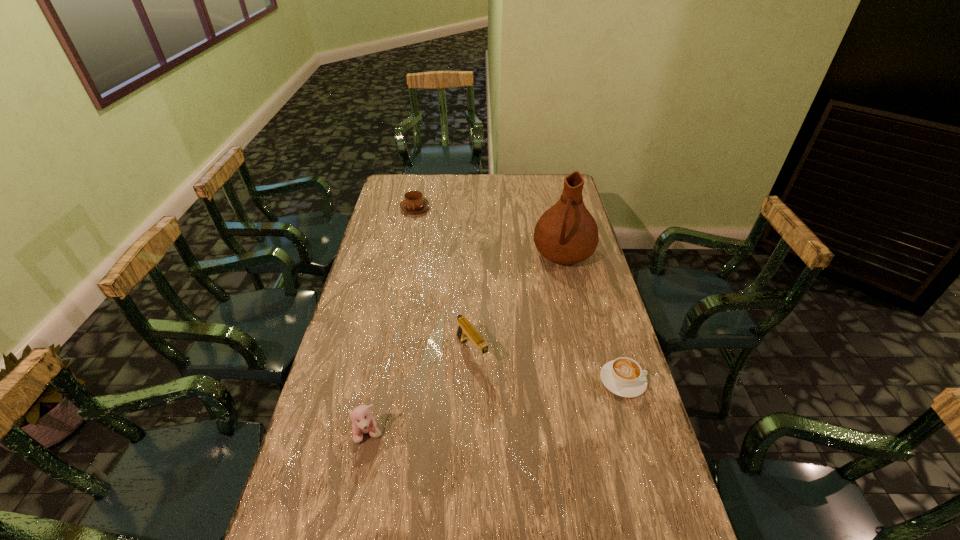
The image size is (960, 540). Identify the location of the nearest object. (363, 422).

You are a GUI agent. You are given a task and a screenshot of the screen. Output one action in this format:
    pyautogui.click(x=<x>, y=<y>)
    Task: Click on the shorter cappuccino
    
    Given the screenshot: What is the action you would take?
    pyautogui.click(x=623, y=376)

Where is `the nearer cappuccino`? The image size is (960, 540). the nearer cappuccino is located at coordinates (623, 376).

The image size is (960, 540). Identify the location of the fourth tallest object. (414, 202).

Locate an element on the screen. This screenshot has width=960, height=540. the left cappuccino is located at coordinates 414,202.

Image resolution: width=960 pixels, height=540 pixels. Find the location of `the third object from right to left`. the third object from right to left is located at coordinates (465, 330).

What are the coordinates of `pitcher` in the screenshot? It's located at (566, 233).

Identify the location of the tallest object. (566, 233).

Locate an element on the screen. This screenshot has width=960, height=540. vacant region located 0.080m at the face of the teddy bear is located at coordinates (360, 476).

At what (x,y) coordinates should I click in order to perform the action: click on vacant area situated 0.100m on the side of the left cappuccino with the handle. Please return your answer as a coordinate pair (x, y). Looking at the image, I should click on (427, 228).